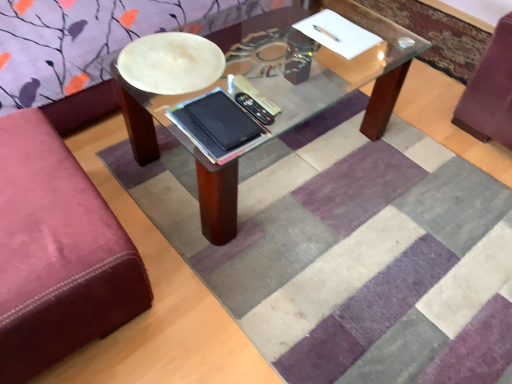
Question: From the image's perspective, is velvet maroon ottoman at left located above or below black matte tablet at center?

Choices:
 (A) below
 (B) above

Answer: (A)

Question: Looking at their shapes, would you say velvet maroon ottoman at left is wider or thinner than black matte tablet at center?

Choices:
 (A) wide
 (B) thin

Answer: (A)

Question: Estimate the real-world distances between objects in this image. Which object is closer to the striped rug at center?

Choices:
 (A) black matte tablet at center
 (B) velvet maroon ottoman at left

Answer: (B)

Question: Based on their relative distances, which object is nearer to the striped rug at center?

Choices:
 (A) black matte tablet at center
 (B) velvet maroon ottoman at left

Answer: (B)